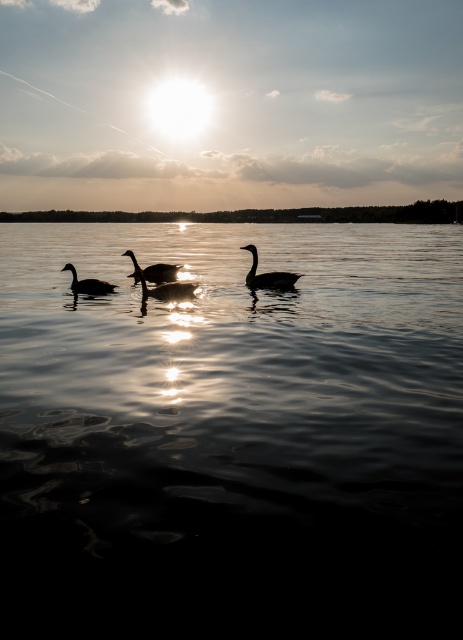
You are standing on the shore of the lake and want to throw a small stone to hit both the black matte goose at center and the matte black duck at center. Can you do it with one throw?

The black matte goose at center and the matte black duck at center are 1.53 meters apart, so it is possible to hit both with one throw if the stone can cover that distance.

You are standing at the edge of the water and see the black matte goose at center. If you want to walk directly towards it, which direction should you move relative to your current position?

Since the black matte goose at center is located at coordinates approximately 0.431 on the x axis and 0.579 on the y axis, you should move towards the center of the image to reach it.